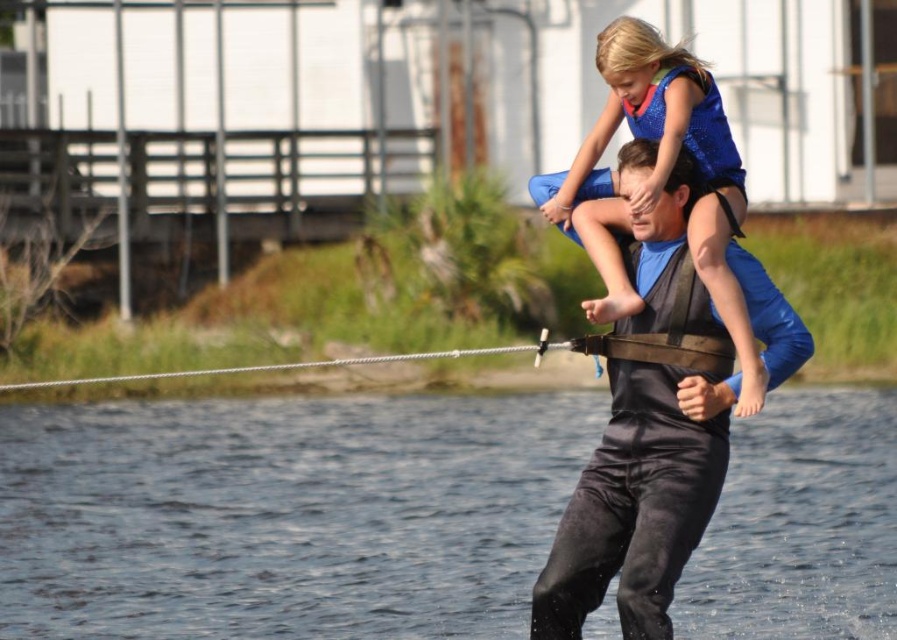
Question: Is black matte life vest at center behind blue sparkly dress at upper center?

Choices:
 (A) yes
 (B) no

Answer: (A)

Question: Which of these objects is positioned farthest from the black matte life vest at center?

Choices:
 (A) blue sparkly dress at upper center
 (B) clear water at center

Answer: (B)

Question: Which object appears closest to the camera in this image?

Choices:
 (A) clear water at center
 (B) blue sparkly dress at upper center

Answer: (B)

Question: Which of these objects is positioned farthest from the clear water at center?

Choices:
 (A) blue sparkly dress at upper center
 (B) black matte life vest at center

Answer: (A)

Question: Does black matte life vest at center have a larger size compared to blue sparkly dress at upper center?

Choices:
 (A) no
 (B) yes

Answer: (A)

Question: Does black matte life vest at center have a greater width compared to blue sparkly dress at upper center?

Choices:
 (A) yes
 (B) no

Answer: (B)